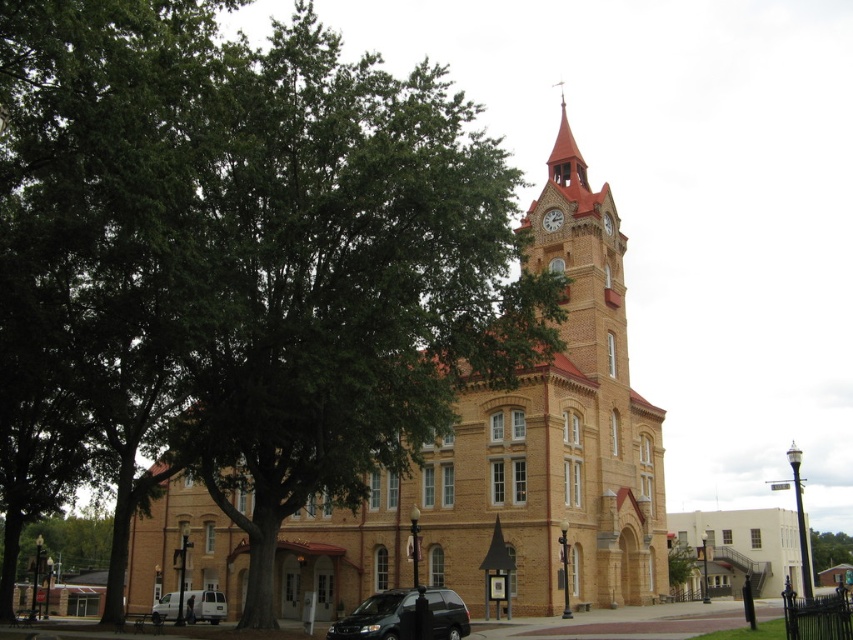
Between green leafy tree at center and matte gold clock at upper center, which one appears on the left side from the viewer's perspective?

matte gold clock at upper center is more to the left.

Who is taller, green leafy tree at center or matte gold clock at upper center?

green leafy tree at center is taller.

This screenshot has width=853, height=640. What are the coordinates of `green leafy tree at center` in the screenshot? It's located at (680, 566).

Who is positioned more to the right, matte black van at lower center or green leafy tree at upper left?

green leafy tree at upper left is more to the right.

Who is taller, matte black van at lower center or green leafy tree at upper left?

matte black van at lower center

At what (x,y) coordinates should I click in order to perform the action: click on matte black van at lower center. Please return your answer as a coordinate pair (x, y). Looking at the image, I should click on (374, 616).

Is white smooth building at lower right closer to the viewer compared to matte black van at lower center?

No, it is behind matte black van at lower center.

Is white smooth building at lower right smaller than matte black van at lower center?

Incorrect, white smooth building at lower right is not smaller in size than matte black van at lower center.

Which is in front, point (712, 557) or point (459, 612)?

Point (459, 612) is in front.

This screenshot has height=640, width=853. What are the coordinates of `white smooth building at lower right` in the screenshot? It's located at (741, 547).